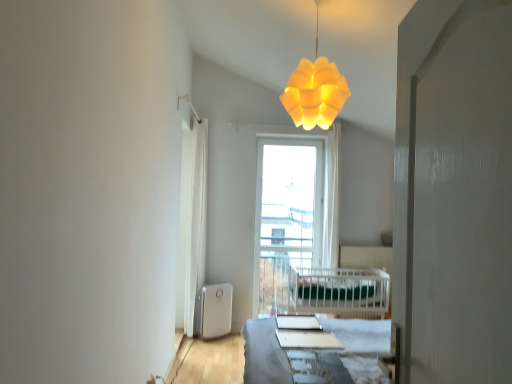
Question: Is yellow matte lampshade at upper center shorter than white glossy screen door at right?

Choices:
 (A) yes
 (B) no

Answer: (A)

Question: Can you confirm if yellow matte lampshade at upper center is positioned to the left of white glossy screen door at right?

Choices:
 (A) yes
 (B) no

Answer: (A)

Question: Would you say yellow matte lampshade at upper center contains white glossy screen door at right?

Choices:
 (A) no
 (B) yes

Answer: (A)

Question: Is yellow matte lampshade at upper center positioned in front of white glossy screen door at right?

Choices:
 (A) no
 (B) yes

Answer: (A)

Question: Is yellow matte lampshade at upper center positioned behind white glossy screen door at right?

Choices:
 (A) yes
 (B) no

Answer: (A)

Question: Can you confirm if yellow matte lampshade at upper center is positioned to the right of white glossy screen door at right?

Choices:
 (A) yes
 (B) no

Answer: (B)

Question: Is the depth of white plastic water heater at lower left less than that of white glossy screen door at right?

Choices:
 (A) no
 (B) yes

Answer: (A)

Question: Considering the relative sizes of white plastic water heater at lower left and white glossy screen door at right in the image provided, is white plastic water heater at lower left bigger than white glossy screen door at right?

Choices:
 (A) no
 (B) yes

Answer: (A)

Question: From a real-world perspective, is white plastic water heater at lower left beneath white glossy screen door at right?

Choices:
 (A) yes
 (B) no

Answer: (A)

Question: Is white plastic water heater at lower left not inside white glossy screen door at right?

Choices:
 (A) no
 (B) yes

Answer: (B)

Question: From a real-world perspective, is white plastic water heater at lower left positioned over white glossy screen door at right based on gravity?

Choices:
 (A) no
 (B) yes

Answer: (A)

Question: Is white glossy screen door at right at the back of white plastic water heater at lower left?

Choices:
 (A) yes
 (B) no

Answer: (B)

Question: Can you confirm if white glossy table at center is taller than white glossy screen door at right?

Choices:
 (A) no
 (B) yes

Answer: (A)